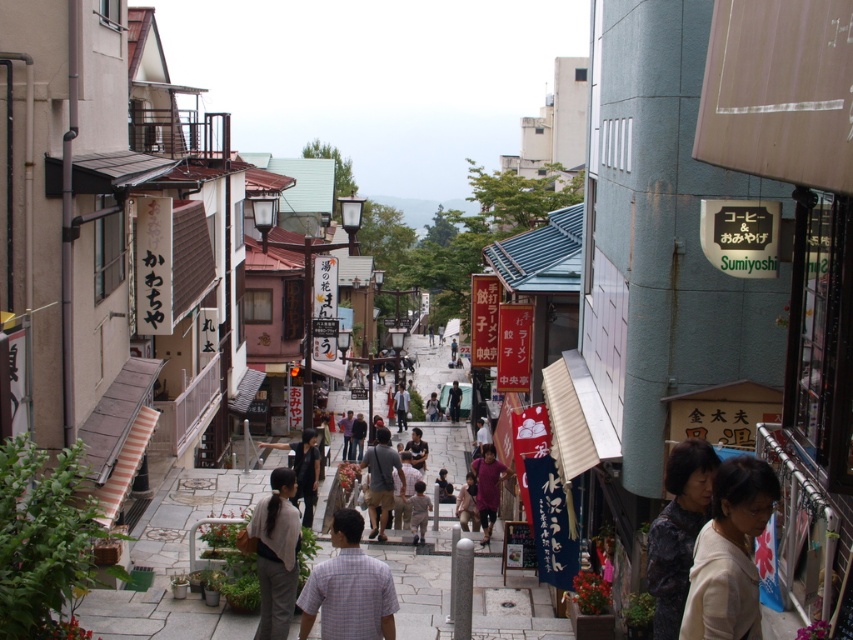
Question: Does camouflage-patterned shirt at lower right appear over light brown fabric shirt at center?

Choices:
 (A) yes
 (B) no

Answer: (A)

Question: Which object is positioned farthest from the light brown leather bag at center?

Choices:
 (A) dark gray fabric pants at center
 (B) matte purple shirt at center

Answer: (A)

Question: Which point is closer to the camera?

Choices:
 (A) dark blue jeans at center
 (B) plaid cotton shirt at center

Answer: (B)

Question: Does light beige sweater at lower right appear under gray woolen sweater at center?

Choices:
 (A) no
 (B) yes

Answer: (A)

Question: Estimate the real-world distances between objects in this image. Which object is farther from the camouflage-patterned shirt at lower right?

Choices:
 (A) dark gray shirt at center
 (B) gray woolen sweater at center
 (C) light brown fabric pants at center
 (D) light brown fabric shirt at center

Answer: (D)

Question: Does light brown leather bag at center appear over dark blue jeans at center?

Choices:
 (A) yes
 (B) no

Answer: (A)